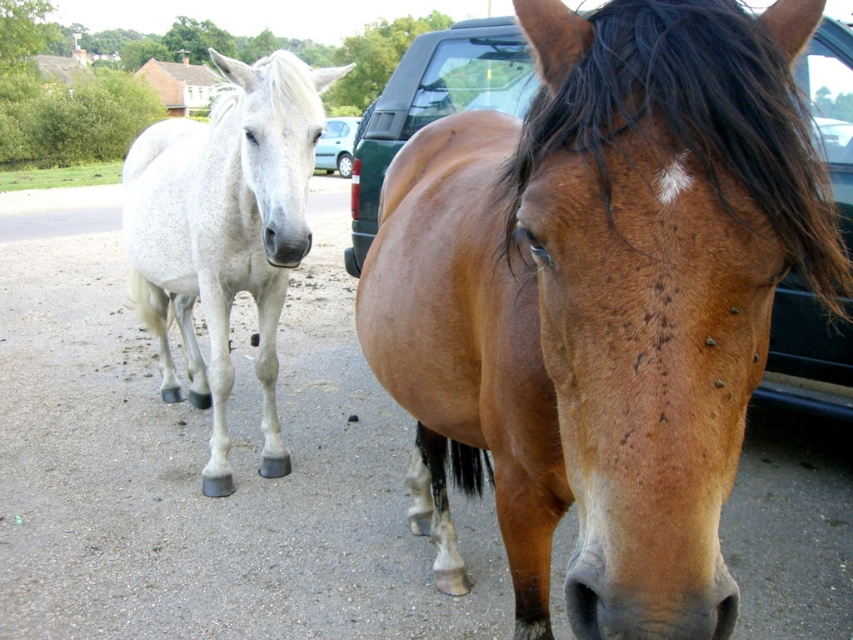
You are standing in front of the two horses in the image. If you want to touch the brown silky mane at center, where should you move your hand to in terms of direction and distance relative to the horse?

The brown silky mane at center is located at coordinates point (688, 113). To touch it, move your hand to the center area of the horse.